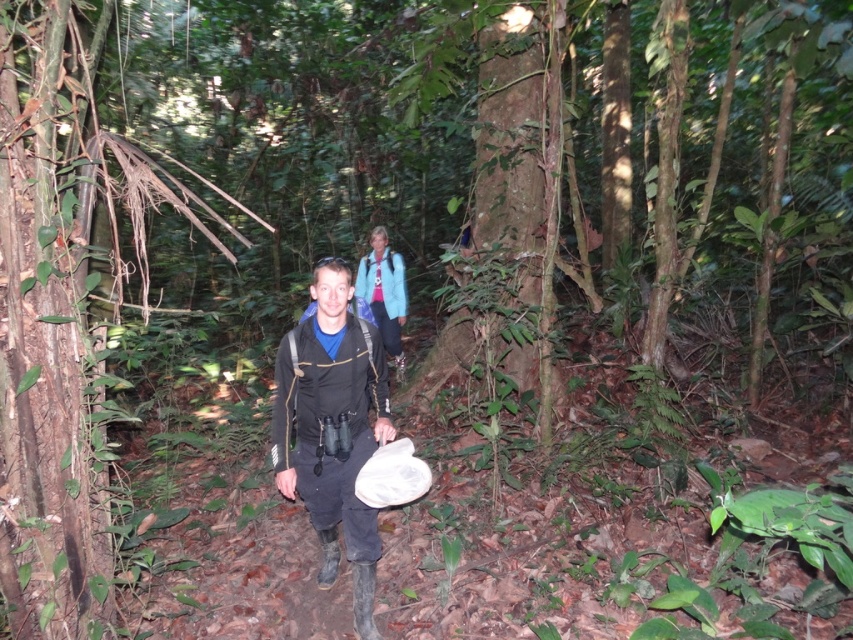
Between matte black jacket at center and blue fabric jacket at upper center, which one appears on the left side from the viewer's perspective?

blue fabric jacket at upper center

Does point (288, 481) lie in front of point (392, 317)?

Yes, point (288, 481) is in front of point (392, 317).

Where is `matte black jacket at center`? This screenshot has height=640, width=853. matte black jacket at center is located at coordinates (332, 429).